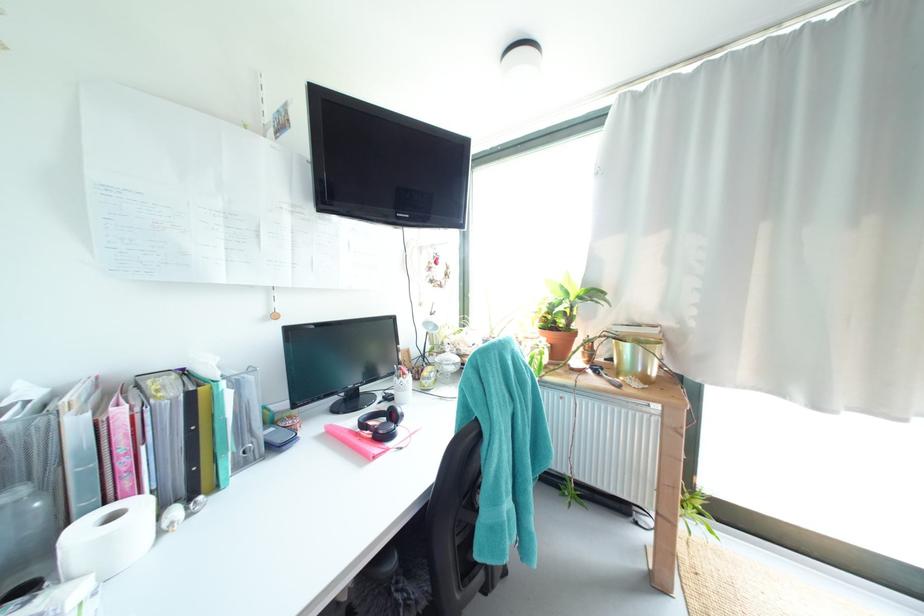
Identify the location of white pen holder. point(402,386).